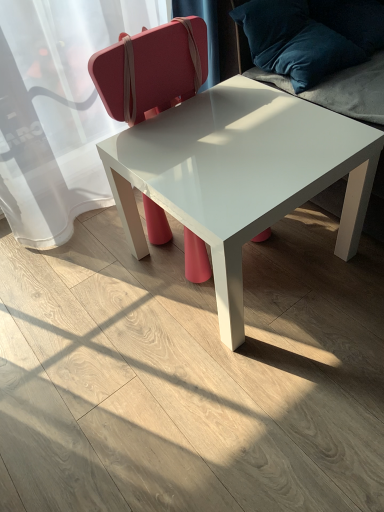
Where is `free region on the left part of white glossy table at center`? free region on the left part of white glossy table at center is located at coordinates (93, 302).